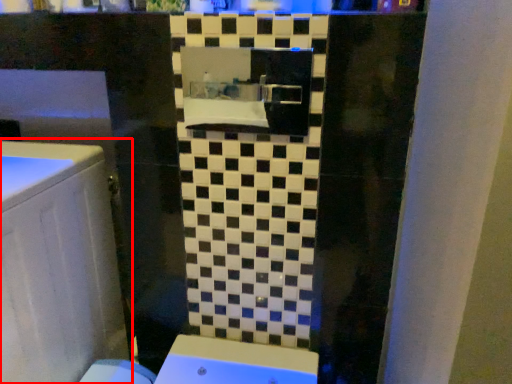
Question: Where is bathroom cabinet (annotated by the red box) located in relation to medicine cabinet in the image?

Choices:
 (A) left
 (B) right

Answer: (A)